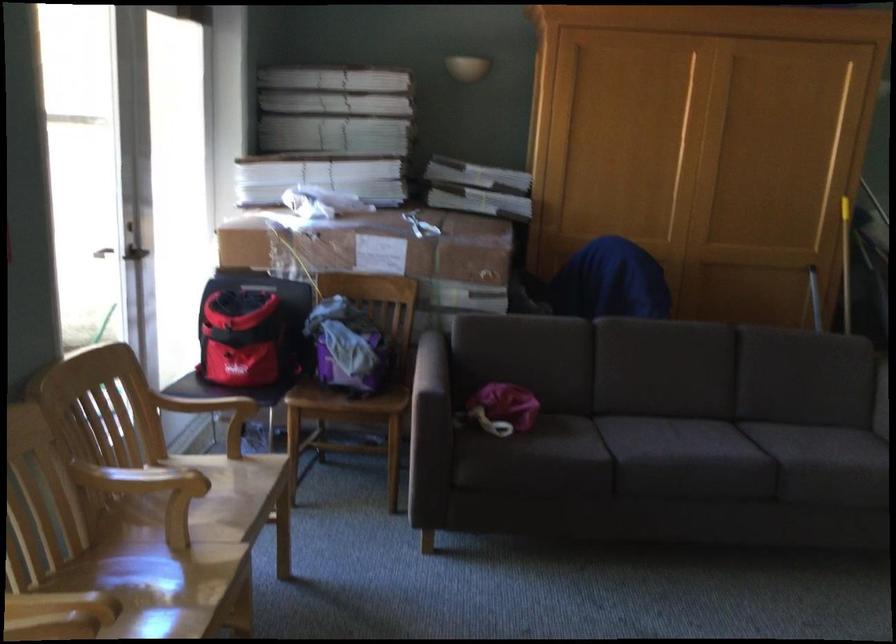
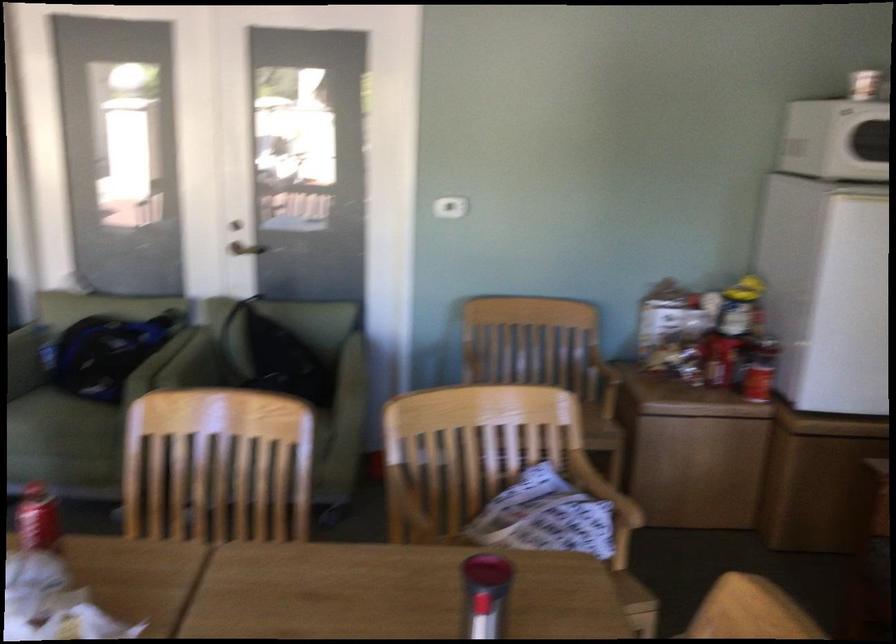
The images are taken continuously from a first-person perspective. In which direction is your viewpoint rotating?

The camera rotated toward right-down.